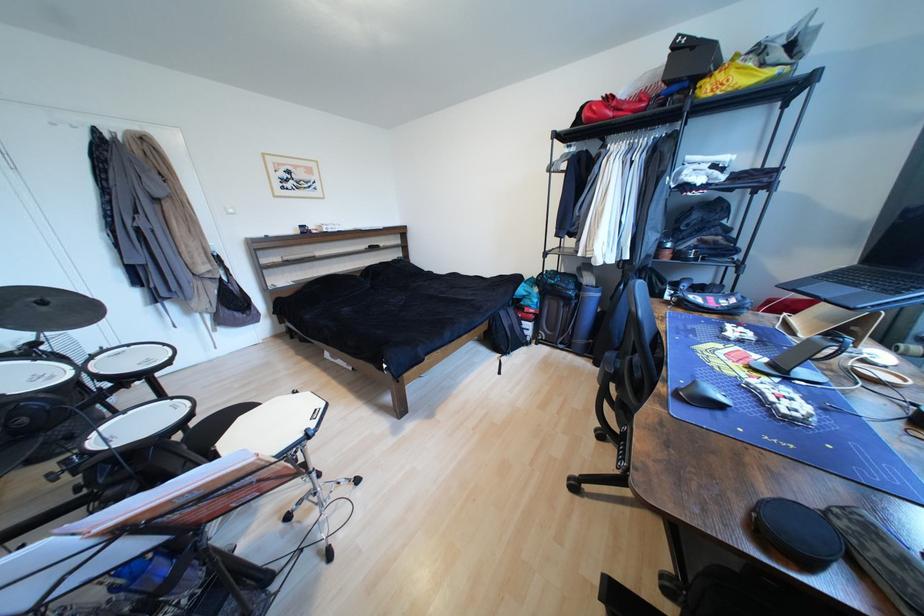
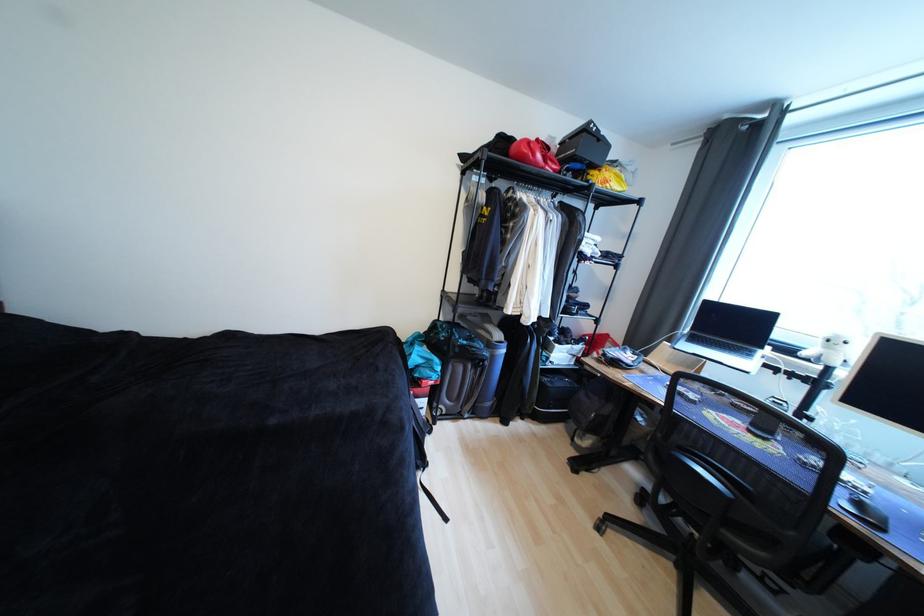
Where in the second image is the point corresponding to point (596, 121) from the first image?

(529, 159)